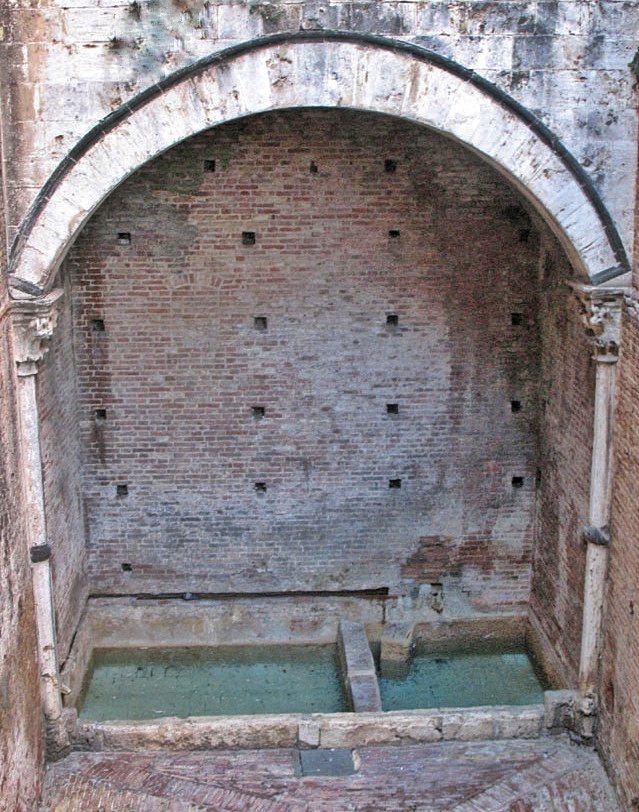
Where is `support beam`? support beam is located at coordinates (34, 506), (599, 473).